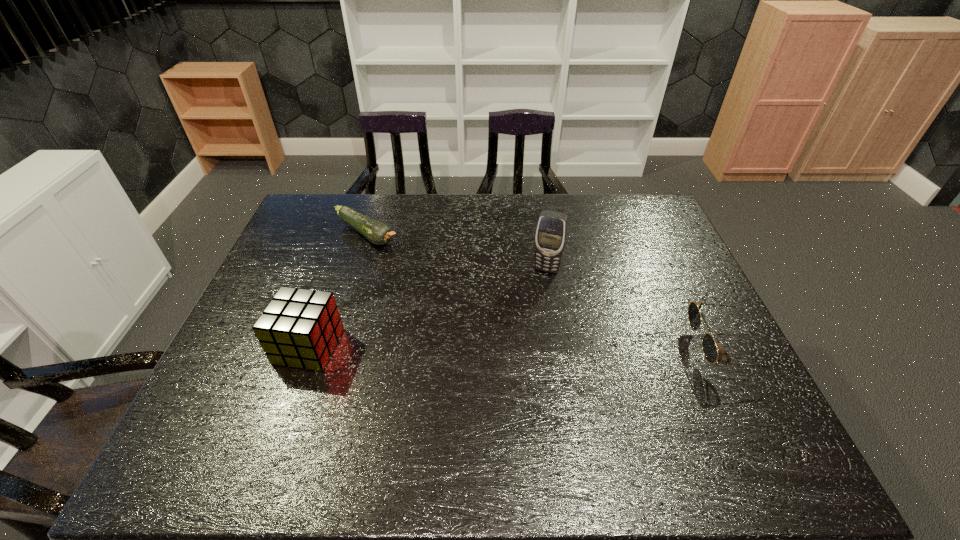
The width and height of the screenshot is (960, 540). I want to click on vacant space located on the front lenses of the second shortest object, so click(x=650, y=347).

Find the location of `vacant position located 0.360m at the blossom end of the farthest object`. vacant position located 0.360m at the blossom end of the farthest object is located at coordinates (468, 301).

At what (x,y) coordinates should I click in order to perform the action: click on vacant area situated at the blossom end of the farthest object. Please return your answer as a coordinate pair (x, y). The height and width of the screenshot is (540, 960). Looking at the image, I should click on (468, 301).

This screenshot has height=540, width=960. I want to click on vacant point located at the blossom end of the farthest object, so point(463,298).

The image size is (960, 540). Identify the location of blank space located 0.130m on the front face of the second farthest object. (533, 306).

I want to click on blank space located on the front face of the second farthest object, so click(x=516, y=355).

At what (x,y) coordinates should I click in order to perform the action: click on free space located on the front face of the second farthest object. Please return your answer as a coordinate pair (x, y). This screenshot has height=540, width=960. Looking at the image, I should click on (519, 347).

Find the location of a particular element. object positioned at the far edge is located at coordinates (378, 233).

You are a GUI agent. You are given a task and a screenshot of the screen. Output one action in this format:
    pyautogui.click(x=<x>, y=<y>)
    Task: Click on the cube located at the left edge
    Image resolution: width=960 pixels, height=540 pixels.
    Given the screenshot: What is the action you would take?
    pyautogui.click(x=299, y=328)

Where is `zucchini that is at the left edge`? This screenshot has height=540, width=960. zucchini that is at the left edge is located at coordinates (378, 233).